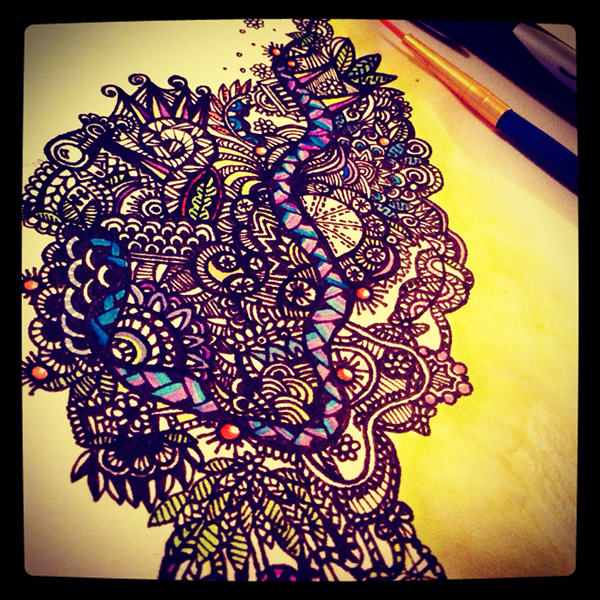
Identify the location of red circles in painting. The height and width of the screenshot is (600, 600). (224, 435), (39, 375), (32, 289), (385, 142), (256, 150), (361, 293).